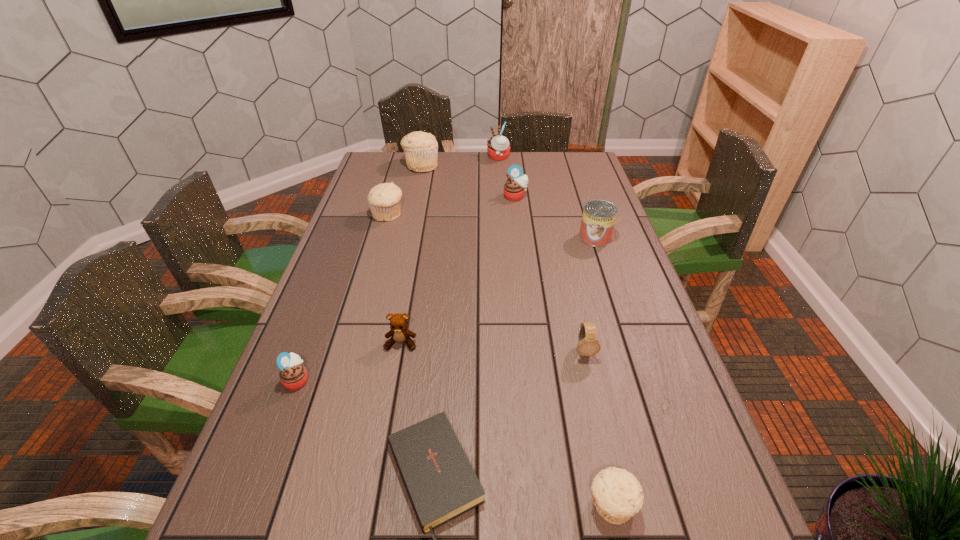
The width and height of the screenshot is (960, 540). Identify the location of the eighth farthest object. (293, 375).

Where is `the second nearest muffin`? Image resolution: width=960 pixels, height=540 pixels. the second nearest muffin is located at coordinates (293, 375).

This screenshot has height=540, width=960. Identify the location of the rightmost muffin. (617, 495).

You are a GUI agent. You are given a task and a screenshot of the screen. Output one action in this format:
    pyautogui.click(x=<x>, y=<y>)
    Task: Click on the smallest beige muffin
    The image size is (960, 540).
    Given the screenshot: What is the action you would take?
    pyautogui.click(x=617, y=495)

Locate an element on the screen. The width and height of the screenshot is (960, 540). blank space located 0.100m on the front-facing side of the biggest pink muffin is located at coordinates (464, 157).

Where is `vacant region located 0.110m on the front-facing side of the biggest pink muffin`? vacant region located 0.110m on the front-facing side of the biggest pink muffin is located at coordinates (461, 157).

Locate an element on the screen. This screenshot has height=540, width=960. vacant space located on the front-facing side of the biggest pink muffin is located at coordinates (472, 157).

Where is `vacant space situated 0.100m on the right of the biggest beige muffin`? The image size is (960, 540). vacant space situated 0.100m on the right of the biggest beige muffin is located at coordinates (464, 166).

The image size is (960, 540). Identify the location of free location located on the front-facing side of the second smallest pink muffin. (517, 216).

The image size is (960, 540). What are the coordinates of `blank space located 0.260m on the back of the second smallest beige muffin` in the screenshot? It's located at (400, 172).